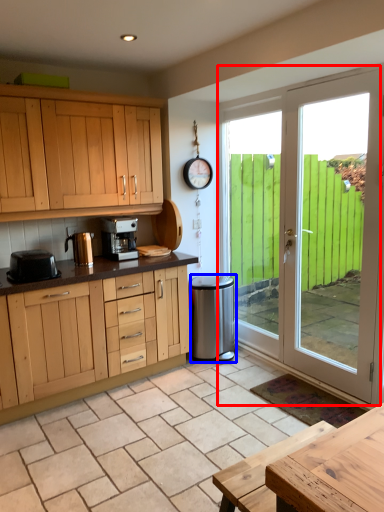
Question: Which point is further to the camera, door (highlighted by a red box) or appliance (highlighted by a blue box)?

Choices:
 (A) door
 (B) appliance

Answer: (B)